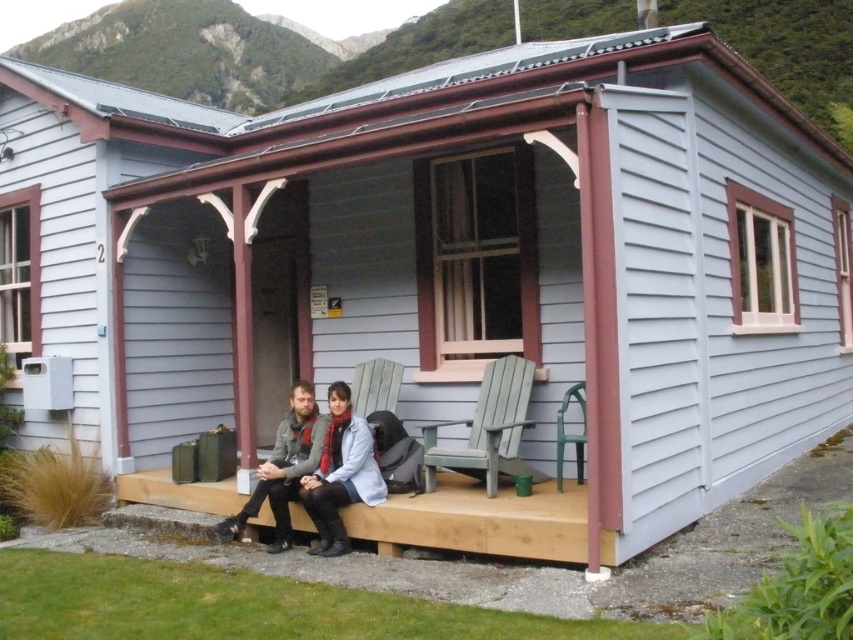
Does wooden bench at center have a greater width compared to matte gray jacket at center?

Correct, the width of wooden bench at center exceeds that of matte gray jacket at center.

What do you see at coordinates (479, 520) in the screenshot? I see `wooden bench at center` at bounding box center [479, 520].

This screenshot has height=640, width=853. In order to click on wooden bench at center in this screenshot , I will do pyautogui.click(x=479, y=520).